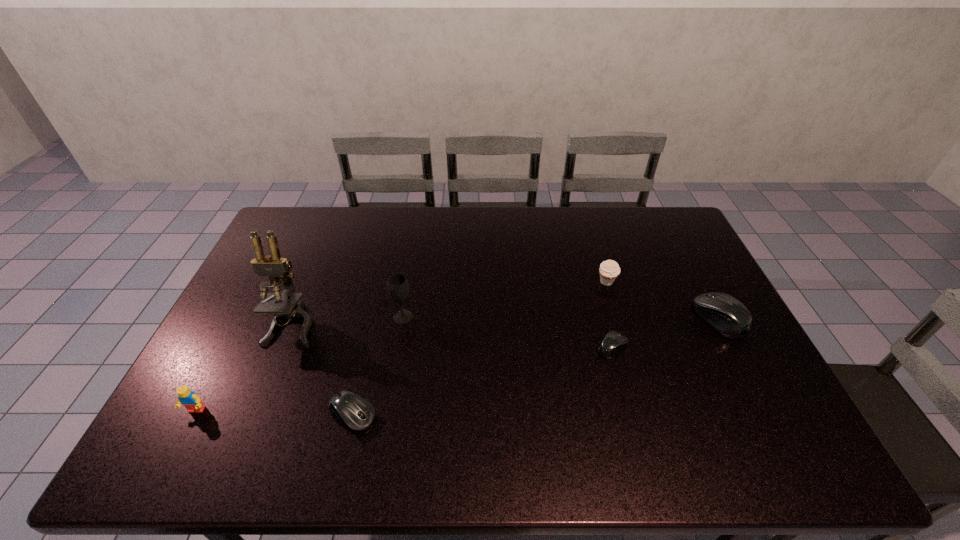
Where is `Lego at the left edge`? Image resolution: width=960 pixels, height=540 pixels. Lego at the left edge is located at coordinates (186, 397).

This screenshot has height=540, width=960. Find the location of `object at the right edge`. object at the right edge is located at coordinates [728, 316].

Where is `object that is at the near left corner`? Image resolution: width=960 pixels, height=540 pixels. object that is at the near left corner is located at coordinates (186, 397).

Locate an element on the screen. This screenshot has height=540, width=960. free region at the far edge of the desktop is located at coordinates (358, 225).

At what (x,y) coordinates should I click in order to perform the action: click on free space at the near edge. Please return your answer as a coordinate pair (x, y). Looking at the image, I should click on (482, 417).

Locate an element on the screen. empty location between the second mouse from right to left and the microscope is located at coordinates (452, 336).

Find the location of a particular element. Image resolution: width=960 pixels, height=540 pixels. vacant point located between the Lego and the farthest object is located at coordinates (401, 346).

Where is `empty location between the nearest mouse and the tallest object`? This screenshot has height=540, width=960. empty location between the nearest mouse and the tallest object is located at coordinates coord(323,370).

This screenshot has width=960, height=540. I want to click on unoccupied area between the farthest object and the third shortest object, so click(x=662, y=300).

You are a GUI agent. You are given a task and a screenshot of the screen. Output one action in this format:
    pyautogui.click(x=<x>, y=<y>)
    Task: Click on the free space between the leftmost mouse and the sixth shortest object
    
    Given the screenshot: What is the action you would take?
    (x=378, y=366)